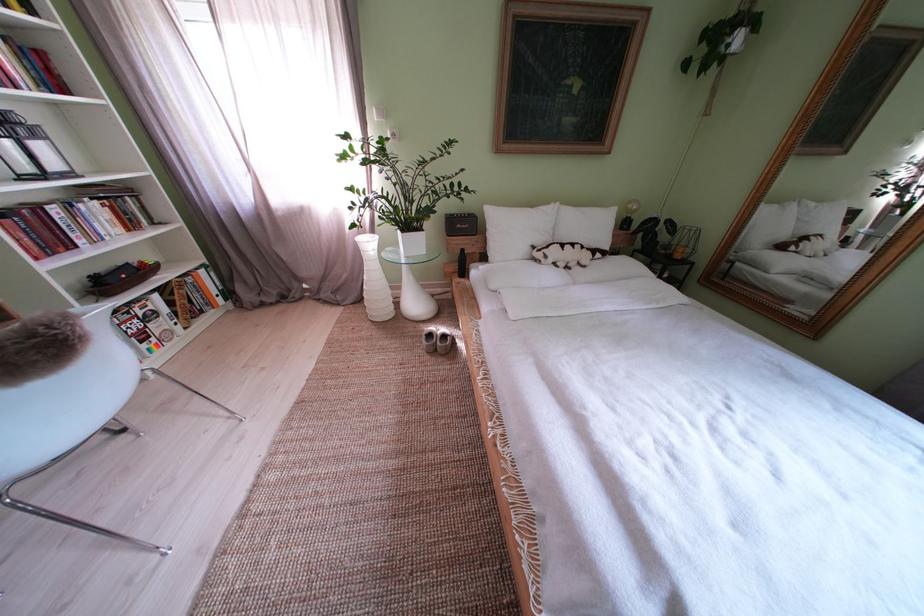
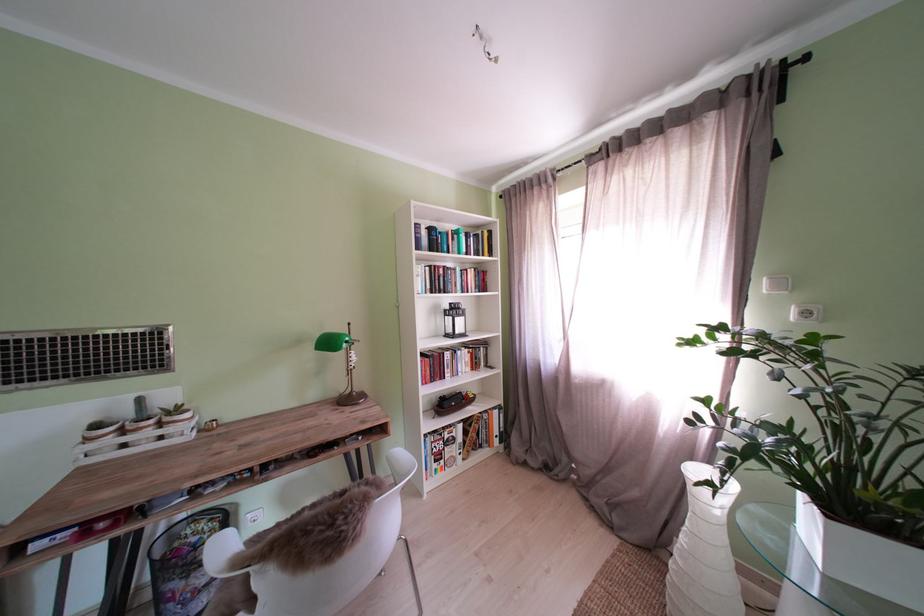
In the second image, find the point that corresponds to point (81, 251) in the first image.

(454, 382)